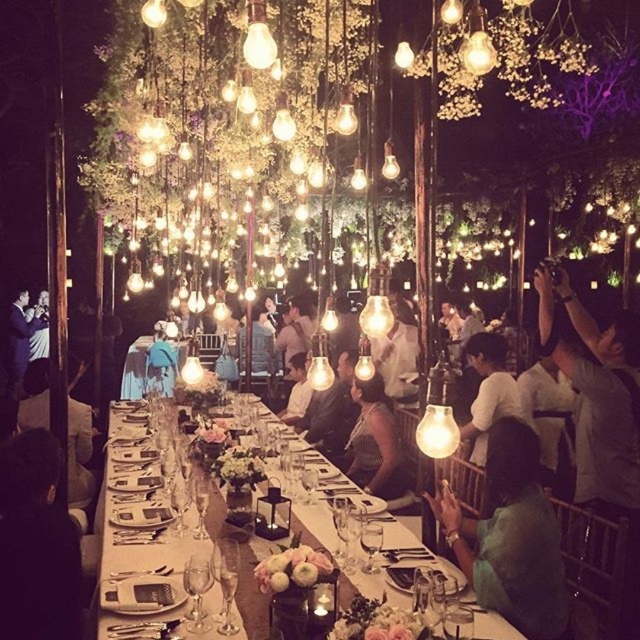
Question: Can you confirm if matte black dress at center is wider than white matte shirt at center?

Choices:
 (A) yes
 (B) no

Answer: (B)

Question: Does black fabric at lower left appear on the left side of matte blue dress at center?

Choices:
 (A) no
 (B) yes

Answer: (A)

Question: Which object appears farthest from the camera in this image?

Choices:
 (A) white matte shirt at center
 (B) white glossy table at center
 (C) matte white shirt at lower right
 (D) matte white shirt at left

Answer: (D)

Question: Is black fabric at lower left in front of matte blue dress at center?

Choices:
 (A) no
 (B) yes

Answer: (B)

Question: Which of the following is the farthest from the observer?

Choices:
 (A) matte white shirt at left
 (B) matte blue dress at center
 (C) matte black dress at center

Answer: (B)

Question: Which is farther from the matte white shirt at left?

Choices:
 (A) black fabric at lower left
 (B) matte white shirt at lower right
 (C) matte black dress at center

Answer: (B)